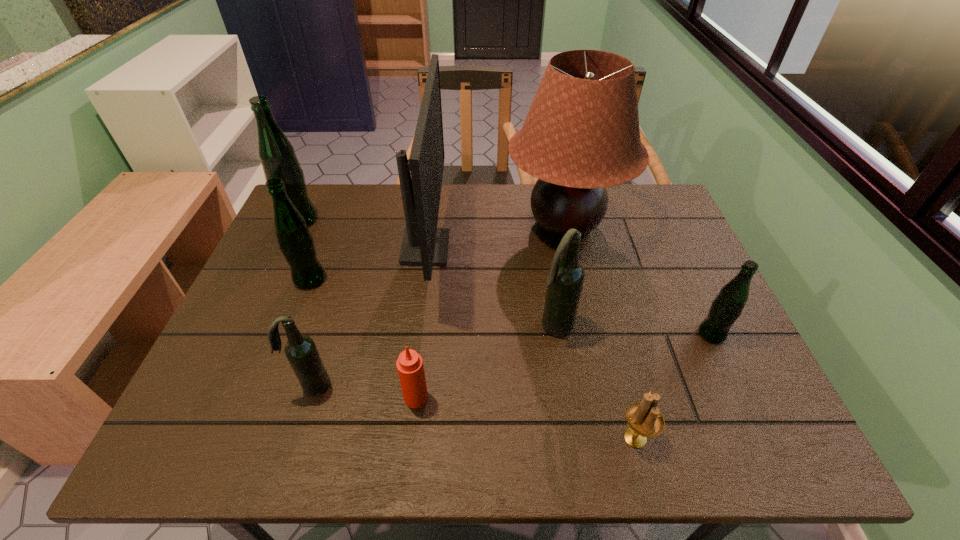
You are a GUI agent. You are given a task and a screenshot of the screen. Output one action in this format:
    pyautogui.click(x=<x>, y=<y>)
    Task: Click on the third object from left to right
    The width and height of the screenshot is (960, 540).
    Given the screenshot: What is the action you would take?
    pyautogui.click(x=301, y=351)

Where is `the nearer dark beer bottle`? Image resolution: width=960 pixels, height=540 pixels. the nearer dark beer bottle is located at coordinates (301, 351).

You are a GUI agent. You are given a task and a screenshot of the screen. Output one action in this format:
    pyautogui.click(x=<x>, y=<y>)
    Task: Click on the Tabasco sauce
    The image size is (960, 540).
    Given the screenshot: What is the action you would take?
    pyautogui.click(x=410, y=368)

This screenshot has width=960, height=540. In order to click on candle holder in this screenshot , I will do `click(644, 419)`.

At what (x,y) coordinates should I click in order to perform the action: click on vacant region located on the front-facing side of the brown lampshade. Please return your answer as a coordinate pair (x, y). Looking at the image, I should click on (481, 225).

Identify the location of free space located 0.230m on the front-facing side of the brown lampshade. This screenshot has height=540, width=960. (428, 225).

Identify the location of free space located on the front-facing side of the brown lampshade. (435, 225).

What are the coordinates of `vacant space located on the front-facing side of the computer monitor` in the screenshot? It's located at (583, 248).

Where is `free space located 0.340m on the right of the farthest beer bottle`? The image size is (960, 540). free space located 0.340m on the right of the farthest beer bottle is located at coordinates (429, 220).

You are a GUI agent. You are given a task and a screenshot of the screen. Output one action in this format:
    pyautogui.click(x=<x>, y=<y>)
    Task: Click on the vacant space positioned 0.110m on the right of the fourth beer bottle from left to right
    The width and height of the screenshot is (960, 540).
    Given the screenshot: What is the action you would take?
    pyautogui.click(x=620, y=327)